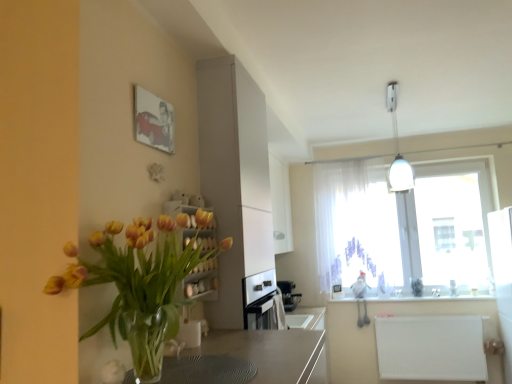
Identify the location of translucent fabric at upper right. (403, 226).

The height and width of the screenshot is (384, 512). What are the coordinates of `matte canvas painting at upper left` in the screenshot? It's located at (153, 120).

Describe the element at coordinates (374, 332) in the screenshot. The height and width of the screenshot is (384, 512). I see `white matte radiator at lower right, the 2th counter top positioned from the top` at that location.

Locate an element on the screen. This screenshot has height=384, width=512. sleek metallic coffee machine at center is located at coordinates (289, 295).

Is matte canvas painting at upper left oriented away from translucent fabric at upper right?

No, matte canvas painting at upper left is not facing the opposite direction of translucent fabric at upper right.

Does point (139, 93) appear closer or farther from the camera than point (385, 185)?

Point (139, 93) appears to be closer to the viewer than point (385, 185).

From a real-world perspective, is matte canvas painting at upper left physically below translucent fabric at upper right?

No.

Can you tell me how much matte canvas painting at upper left and translucent fabric at upper right differ in facing direction?

90 degrees separate the facing orientations of matte canvas painting at upper left and translucent fabric at upper right.

From their relative heights in the image, would you say translucent glass vase at left is taller or shorter than white glossy light fixture at upper right?

In the image, translucent glass vase at left appears to be shorter than white glossy light fixture at upper right.

Looking at this image, is translucent glass vase at left at the right side of white glossy light fixture at upper right?

No.

Would you say translucent glass vase at left contains white glossy light fixture at upper right?

No, white glossy light fixture at upper right is located outside of translucent glass vase at left.

Can you confirm if white glossy light fixture at upper right is shorter than matte white cabinet at center?

Yes, white glossy light fixture at upper right is shorter than matte white cabinet at center.

Considering the relative sizes of white glossy light fixture at upper right and matte white cabinet at center in the image provided, is white glossy light fixture at upper right thinner than matte white cabinet at center?

No.

You are a GUI agent. You are given a task and a screenshot of the screen. Output one action in this format:
    pyautogui.click(x=<x>, y=<y>)
    Task: Click on the light fixture behind the matte white cabinet at center
    This screenshot has height=384, width=512.
    Given the screenshot: What is the action you would take?
    pyautogui.click(x=397, y=150)

From the image's perspective, between white glossy light fixture at upper right and matte white cabinet at center, who is located below?

From the image's view, matte white cabinet at center is below.

Is sleek metallic coffee machine at center located within white glossy counter top at lower center, the 1th counter top when ordered from top to bottom?

No, white glossy counter top at lower center, the 1th counter top when ordered from top to bottom, does not contain sleek metallic coffee machine at center.

Is white glossy counter top at lower center, the 1th counter top when ordered from top to bottom, far from sleek metallic coffee machine at center?

No, white glossy counter top at lower center, the 1th counter top when ordered from top to bottom, is not far from sleek metallic coffee machine at center.

Based on their sizes in the image, would you say white glossy counter top at lower center, the 1th counter top when ordered from top to bottom, is bigger or smaller than sleek metallic coffee machine at center?

white glossy counter top at lower center, the 1th counter top when ordered from top to bottom, is smaller than sleek metallic coffee machine at center.

In the scene shown: From a real-world perspective, between white glossy counter top at lower center, the 1th counter top when ordered from top to bottom, and sleek metallic coffee machine at center, who is vertically higher?

sleek metallic coffee machine at center, from a real-world perspective.

From a real-world perspective, which is physically above, white sheer curtain at upper right or matte white cabinet at center?

matte white cabinet at center is physically above.

Is white sheer curtain at upper right to the left of matte white cabinet at center from the viewer's perspective?

In fact, white sheer curtain at upper right is to the right of matte white cabinet at center.

From their relative heights in the image, would you say white sheer curtain at upper right is taller or shorter than matte white cabinet at center?

Clearly, white sheer curtain at upper right is taller compared to matte white cabinet at center.

From a real-world perspective, which is physically below, white glossy counter top at lower center, the 2th counter top in the bottom-to-top sequence, or white matte radiator at lower right, the 2th counter top positioned from the top?

In real-world perspective, white matte radiator at lower right, the 2th counter top positioned from the top, is lower.

Based on the photo, is white matte radiator at lower right, the 1th counter top in the bottom-to-top sequence, at the back of white glossy counter top at lower center, the 2th counter top in the bottom-to-top sequence?

white glossy counter top at lower center, the 2th counter top in the bottom-to-top sequence, is not turned away from white matte radiator at lower right, the 1th counter top in the bottom-to-top sequence.

Is white glossy counter top at lower center, the 1th counter top when ordered from top to bottom, next to white matte radiator at lower right, the 2th counter top positioned from the top, and touching it?

No, white glossy counter top at lower center, the 1th counter top when ordered from top to bottom, is not with white matte radiator at lower right, the 2th counter top positioned from the top.

Locate an element on the screen. The height and width of the screenshot is (384, 512). counter top that appears on the right of white glossy counter top at lower center, the 2th counter top in the bottom-to-top sequence is located at coordinates click(374, 332).

Which object is more forward, white matte radiator at lower right, the 1th counter top in the bottom-to-top sequence, or white glossy counter top at lower center, the 1th counter top when ordered from top to bottom?

white matte radiator at lower right, the 1th counter top in the bottom-to-top sequence, is in front.

From a real-world perspective, which is physically below, white matte radiator at lower right, the 1th counter top in the bottom-to-top sequence, or white glossy counter top at lower center, the 1th counter top when ordered from top to bottom?

From a 3D spatial view, white matte radiator at lower right, the 1th counter top in the bottom-to-top sequence, is below.

Is white matte radiator at lower right, the 2th counter top positioned from the top, not close to white glossy counter top at lower center, the 1th counter top when ordered from top to bottom?

No, there isn't a large distance between white matte radiator at lower right, the 2th counter top positioned from the top, and white glossy counter top at lower center, the 1th counter top when ordered from top to bottom.

Identify the location of counter top that is on the right side of white glossy counter top at lower center, the 2th counter top in the bottom-to-top sequence. 374,332.

The height and width of the screenshot is (384, 512). What are the coordinates of `window on the right of matte canvas painting at upper left` in the screenshot? It's located at (403, 226).

At what (x,y) coordinates should I click in order to perform the action: click on light fixture above the translucent glass vase at left (from a real-world perspective). Please return your answer as a coordinate pair (x, y). The width and height of the screenshot is (512, 384). Looking at the image, I should click on (397, 150).

Looking at the image, which one is located further to sleek metallic coffee machine at center, white matte radiator at lower right, the 1th counter top in the bottom-to-top sequence, or white sheer curtain at upper right?

white sheer curtain at upper right is positioned further to the anchor sleek metallic coffee machine at center.

Estimate the real-world distances between objects in this image. Which object is closer to translucent fabric at upper right, white glossy counter top at lower center, the 1th counter top when ordered from top to bottom, or translucent glass vase at left?

white glossy counter top at lower center, the 1th counter top when ordered from top to bottom, is closer to translucent fabric at upper right.

Based on their spatial positions, is matte canvas painting at upper left or matte white cabinet at center further from sleek metallic coffee machine at center?

matte canvas painting at upper left lies further to sleek metallic coffee machine at center than the other object.

Looking at this image, estimate the real-world distances between objects in this image. Which object is further from white glossy counter top at lower center, the 2th counter top in the bottom-to-top sequence, white glossy light fixture at upper right or translucent glass vase at left?

translucent glass vase at left lies further to white glossy counter top at lower center, the 2th counter top in the bottom-to-top sequence, than the other object.

Considering their positions, is translucent glass vase at left positioned further to translucent fabric at upper right than white glossy light fixture at upper right?

The object further to translucent fabric at upper right is translucent glass vase at left.

Looking at this image, considering their positions, is white glossy light fixture at upper right positioned closer to translucent glass vase at left than translucent fabric at upper right?

The object closer to translucent glass vase at left is white glossy light fixture at upper right.

Which object lies nearer to the anchor point matte canvas painting at upper left, white glossy counter top at lower center, the 2th counter top in the bottom-to-top sequence, or translucent fabric at upper right?

Based on the image, translucent fabric at upper right appears to be nearer to matte canvas painting at upper left.

Estimate the real-world distances between objects in this image. Which object is further from white glossy light fixture at upper right, white matte radiator at lower right, the 2th counter top positioned from the top, or white sheer curtain at upper right?

white matte radiator at lower right, the 2th counter top positioned from the top, is positioned further to the anchor white glossy light fixture at upper right.

At what (x,y) coordinates should I click in order to perform the action: click on light fixture between matte canvas painting at upper left and white sheer curtain at upper right from front to back. Please return your answer as a coordinate pair (x, y). The width and height of the screenshot is (512, 384). Looking at the image, I should click on (397, 150).

Find the location of a particular element. The height and width of the screenshot is (384, 512). curtain between matte white cabinet at center and sleek metallic coffee machine at center in the front-back direction is located at coordinates (356, 226).

You are a GUI agent. You are given a task and a screenshot of the screen. Output one action in this format:
    pyautogui.click(x=<x>, y=<y>)
    Task: Click on the curtain located between white glossy light fixture at upper right and sleek metallic coffee machine at center in the depth direction
    The image size is (512, 384).
    Given the screenshot: What is the action you would take?
    pyautogui.click(x=356, y=226)

Find the location of a particular element. The width and height of the screenshot is (512, 384). cabinetry positioned between translucent glass vase at left and sleek metallic coffee machine at center from near to far is located at coordinates (234, 178).